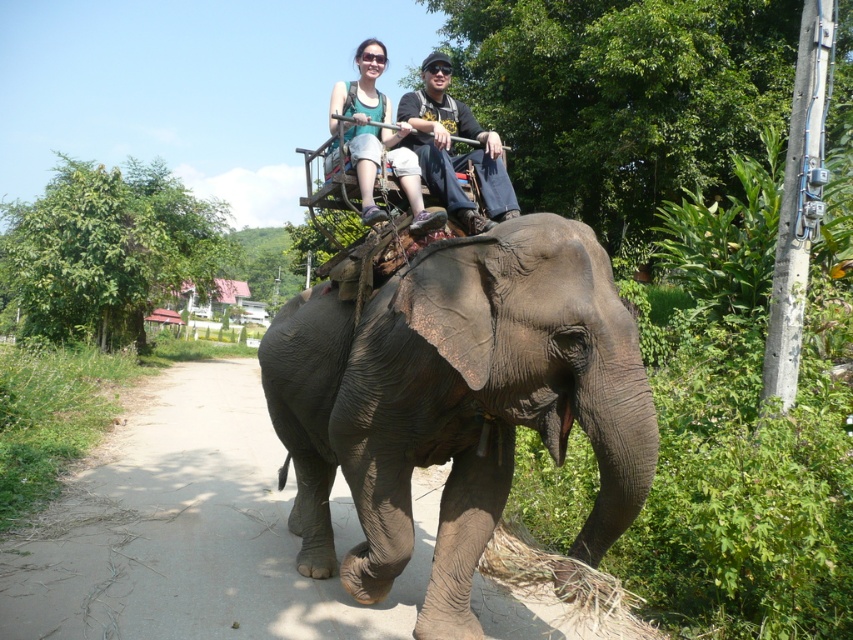
Question: Which point is farther to the camera?

Choices:
 (A) (500, 285)
 (B) (479, 212)

Answer: (B)

Question: From the image, what is the correct spatial relationship of gray textured elephant at center in relation to matte black elephant at center?

Choices:
 (A) right
 (B) left

Answer: (B)

Question: Which of the following is the farthest from the observer?

Choices:
 (A) matte black elephant at center
 (B) gray textured elephant at center

Answer: (A)

Question: Is gray textured elephant at center positioned behind matte black elephant at center?

Choices:
 (A) no
 (B) yes

Answer: (A)

Question: Does gray textured elephant at center appear on the right side of matte black elephant at center?

Choices:
 (A) yes
 (B) no

Answer: (B)